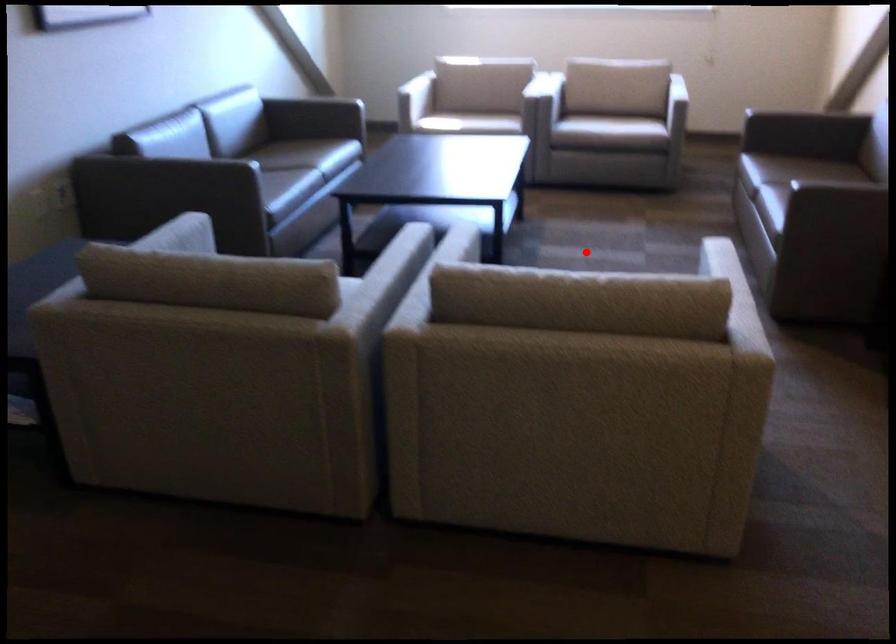
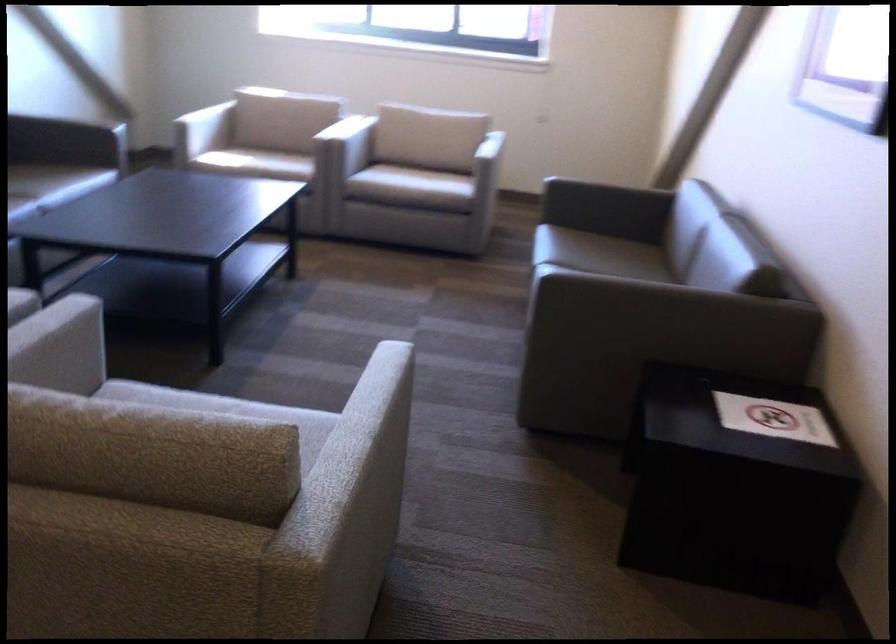
In the second image, find the point that corresponds to the highlighted location in the first image.

(352, 330)